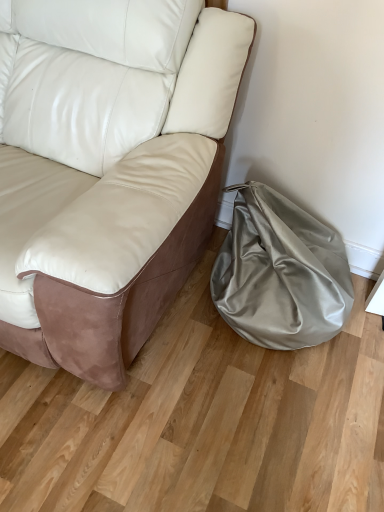
Find the location of `white leather couch at center`. white leather couch at center is located at coordinates (107, 193).

This screenshot has width=384, height=512. What do you see at coordinates (107, 193) in the screenshot?
I see `white leather couch at center` at bounding box center [107, 193].

This screenshot has height=512, width=384. Describe the element at coordinates (280, 273) in the screenshot. I see `satin beige bean bag at lower right` at that location.

Where is `satin beige bean bag at lower right`? satin beige bean bag at lower right is located at coordinates (280, 273).

At what (x,y) coordinates should I click in order to perform the action: click on white leather couch at center. Please return your answer as a coordinate pair (x, y). This screenshot has width=384, height=512. Looking at the image, I should click on (107, 193).

Which object is positioned more to the right, white leather couch at center or satin beige bean bag at lower right?

satin beige bean bag at lower right is more to the right.

Which is behind, white leather couch at center or satin beige bean bag at lower right?

satin beige bean bag at lower right is further from the camera.

Does point (48, 183) appear closer or farther from the camera than point (341, 321)?

Point (48, 183) appears to be closer to the viewer than point (341, 321).

From the image's perspective, is white leather couch at center over satin beige bean bag at lower right?

Yes.

From a real-world perspective, is white leather couch at center above or below satin beige bean bag at lower right?

From a real-world perspective, white leather couch at center is physically above satin beige bean bag at lower right.

Which of these two, white leather couch at center or satin beige bean bag at lower right, is thinner?

Thinner between the two is satin beige bean bag at lower right.

Is white leather couch at center shorter than satin beige bean bag at lower right?

No, white leather couch at center is not shorter than satin beige bean bag at lower right.

Can you confirm if white leather couch at center is smaller than satin beige bean bag at lower right?

No, white leather couch at center is not smaller than satin beige bean bag at lower right.

Is white leather couch at center inside the boundaries of satin beige bean bag at lower right, or outside?

white leather couch at center is not enclosed by satin beige bean bag at lower right.

Is white leather couch at center next to satin beige bean bag at lower right?

No, white leather couch at center is not making contact with satin beige bean bag at lower right.

Could you tell me if white leather couch at center is facing satin beige bean bag at lower right?

No, white leather couch at center is not facing towards satin beige bean bag at lower right.

This screenshot has height=512, width=384. I want to click on bean bag chair behind the white leather couch at center, so click(x=280, y=273).

Does satin beige bean bag at lower right appear on the left side of white leather couch at center?

No.

Who is more distant, satin beige bean bag at lower right or white leather couch at center?

Positioned behind is satin beige bean bag at lower right.

Between point (306, 250) and point (235, 95), which one is positioned in front?

The point (235, 95) is in front.

From the image's perspective, which is above, satin beige bean bag at lower right or white leather couch at center?

white leather couch at center appears higher in the image.

From a real-world perspective, which object rests below the other?

satin beige bean bag at lower right, from a real-world perspective.

Is satin beige bean bag at lower right wider than white leather couch at center?

Incorrect, the width of satin beige bean bag at lower right does not surpass that of white leather couch at center.

Can you confirm if satin beige bean bag at lower right is shorter than white leather couch at center?

Indeed, satin beige bean bag at lower right has a lesser height compared to white leather couch at center.

Does satin beige bean bag at lower right have a smaller size compared to white leather couch at center?

Indeed, satin beige bean bag at lower right has a smaller size compared to white leather couch at center.

Which is correct: satin beige bean bag at lower right is inside white leather couch at center, or outside of it?

satin beige bean bag at lower right lies outside white leather couch at center.

In the scene shown: Does satin beige bean bag at lower right touch white leather couch at center?

There is a gap between satin beige bean bag at lower right and white leather couch at center.

Is satin beige bean bag at lower right looking in the opposite direction of white leather couch at center?

satin beige bean bag at lower right is not turned away from white leather couch at center.

How many degrees apart are the facing directions of satin beige bean bag at lower right and white leather couch at center?

They differ by 0.000393 degrees in their facing directions.

Measure the distance from satin beige bean bag at lower right to white leather couch at center.

satin beige bean bag at lower right and white leather couch at center are 44.91 centimeters apart.

Identify the location of bean bag chair lying on the right of white leather couch at center. The width and height of the screenshot is (384, 512). (280, 273).

There is a satin beige bean bag at lower right. Find the location of `studio couch above it (from a real-world perspective)`. studio couch above it (from a real-world perspective) is located at coordinates (107, 193).

Where is `bean bag chair below the white leather couch at center (from a real-world perspective)`? bean bag chair below the white leather couch at center (from a real-world perspective) is located at coordinates (280, 273).